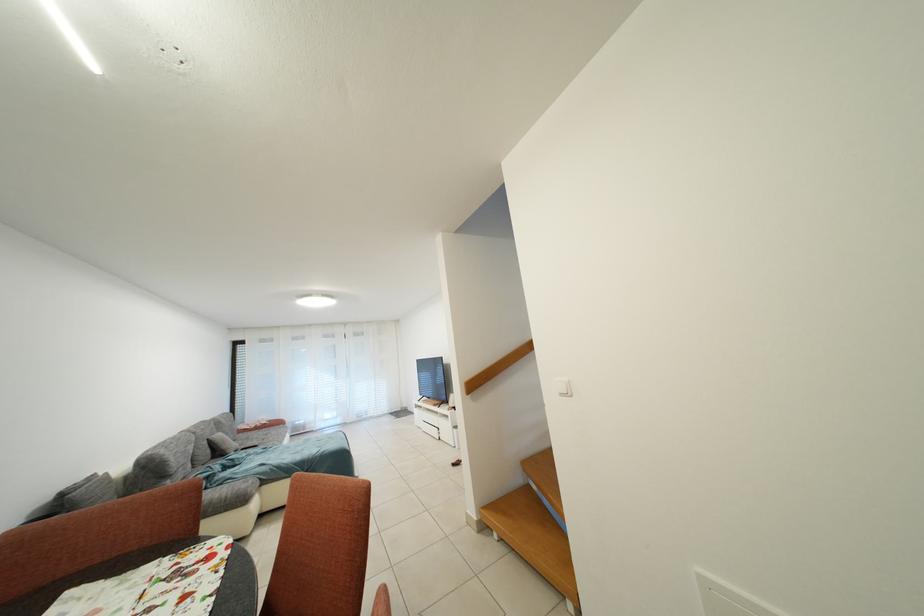
What do you see at coordinates (427, 421) in the screenshot? I see `a white cabinet drawer` at bounding box center [427, 421].